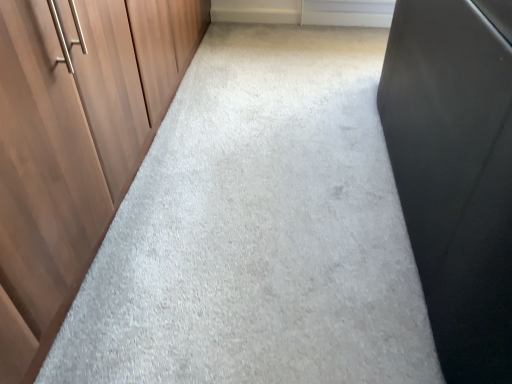
Question: Is point (376, 1) closer or farther from the camera than point (109, 13)?

Choices:
 (A) closer
 (B) farther

Answer: (B)

Question: From the image's perspective, relative to wooden at left, is white matte window at upper center above or below?

Choices:
 (A) below
 (B) above

Answer: (B)

Question: From a real-world perspective, is white matte window at upper center physically located above or below wooden at left?

Choices:
 (A) above
 (B) below

Answer: (B)

Question: Is wooden at left in front of or behind white matte window at upper center in the image?

Choices:
 (A) behind
 (B) front

Answer: (B)

Question: Considering the positions of wooden at left and white matte window at upper center in the image, is wooden at left taller or shorter than white matte window at upper center?

Choices:
 (A) short
 (B) tall

Answer: (B)

Question: From a real-world perspective, relative to white matte window at upper center, is wooden at left vertically above or below?

Choices:
 (A) above
 (B) below

Answer: (A)

Question: In terms of size, does wooden at left appear bigger or smaller than white matte window at upper center?

Choices:
 (A) big
 (B) small

Answer: (A)